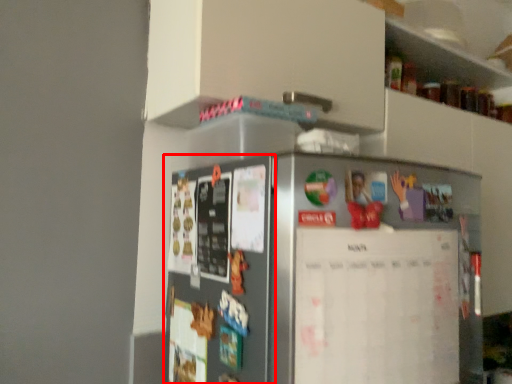
Question: From the image's perspective, considering the relative positions of fridge (annotated by the red box) and bulletin board in the image provided, where is fridge (annotated by the red box) located with respect to the staircase?

Choices:
 (A) above
 (B) below

Answer: (A)